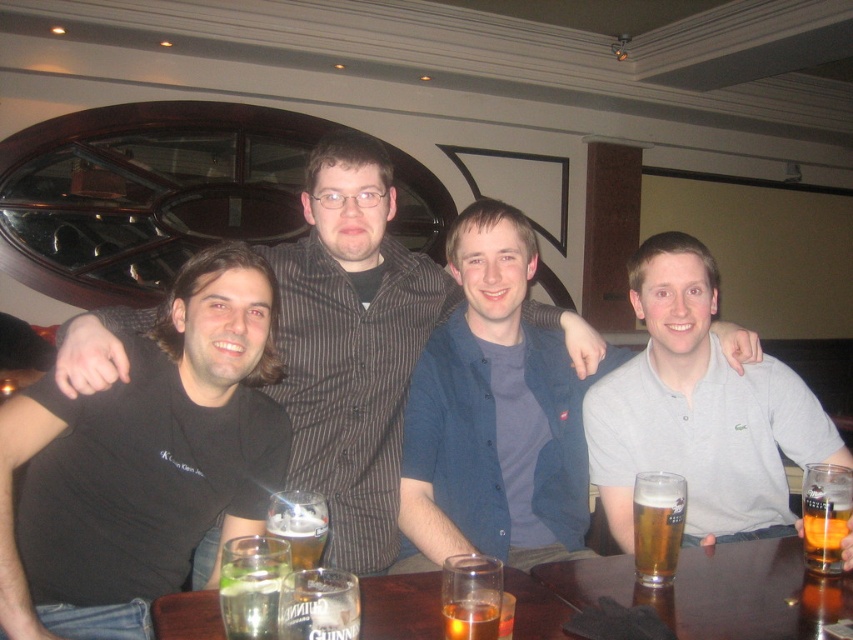
You are standing 1.5 meters away from the camera. You want to reach a point marked at coordinates point (56,582). Is the point closer to you or farther away than your current position?

The point (56,582) is 1.45 meters from the camera, which is slightly closer than your current position of 1.5 meters away. Therefore, the point is closer to you.